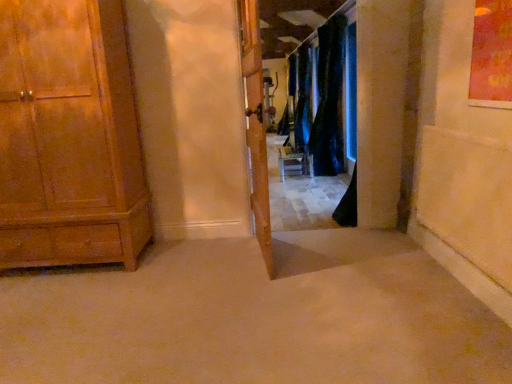
Question: Looking at the image, does wooden cabinet at left seem bigger or smaller compared to wooden door at center?

Choices:
 (A) big
 (B) small

Answer: (A)

Question: From a real-world perspective, is wooden cabinet at left physically located above or below wooden door at center?

Choices:
 (A) above
 (B) below

Answer: (A)

Question: Considering the real-world distances, which object is closest to the dark blue velvet curtains at center, arranged as the 2th curtain when viewed from the front?

Choices:
 (A) black velvet curtain at center, which is counted as the 1th curtain, starting from the front
 (B) wooden door at center
 (C) wooden cabinet at left

Answer: (A)

Question: Which object is the farthest from the dark blue velvet curtains at center, arranged as the 2th curtain when viewed from the front?

Choices:
 (A) wooden cabinet at left
 (B) black velvet curtain at center, which is counted as the 1th curtain, starting from the front
 (C) wooden door at center

Answer: (A)